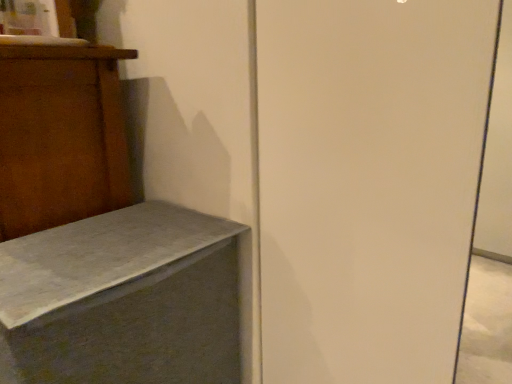
This screenshot has width=512, height=384. Find the location of `matte gray concrete bench at lower left`. matte gray concrete bench at lower left is located at coordinates (123, 300).

This screenshot has height=384, width=512. Describe the element at coordinates (123, 300) in the screenshot. I see `matte gray concrete bench at lower left` at that location.

Measure the distance between matte gray concrete bench at lower left and camera.

The distance of matte gray concrete bench at lower left from camera is 69.78 centimeters.

Measure the distance between white matte screen door at center and camera.

They are 65.05 centimeters apart.

In order to face white matte screen door at center, should I rotate leftwards or rightwards?

Rotate right and turn 14.282 degrees.

Describe the element at coordinates (368, 183) in the screenshot. This screenshot has height=384, width=512. I see `white matte screen door at center` at that location.

The image size is (512, 384). Identify the location of white matte screen door at center. (368, 183).

Identify the location of matte gray concrete bench at lower left. Image resolution: width=512 pixels, height=384 pixels. (123, 300).

Between matte gray concrete bench at lower left and white matte screen door at center, which one appears on the right side from the viewer's perspective?

white matte screen door at center is more to the right.

Between matte gray concrete bench at lower left and white matte screen door at center, which one is positioned behind?

matte gray concrete bench at lower left.

Which is farther from the camera, (59,327) or (445,3)?

Positioned behind is point (59,327).

From the image's perspective, which object appears higher, matte gray concrete bench at lower left or white matte screen door at center?

white matte screen door at center, from the image's perspective.

From a real-world perspective, between matte gray concrete bench at lower left and white matte screen door at center, who is vertically higher?

white matte screen door at center, from a real-world perspective.

Considering the sizes of objects matte gray concrete bench at lower left and white matte screen door at center in the image provided, who is wider, matte gray concrete bench at lower left or white matte screen door at center?

matte gray concrete bench at lower left is wider.

Can you confirm if matte gray concrete bench at lower left is taller than white matte screen door at center?

No.

Does matte gray concrete bench at lower left have a smaller size compared to white matte screen door at center?

Actually, matte gray concrete bench at lower left might be larger than white matte screen door at center.

Which is correct: matte gray concrete bench at lower left is inside white matte screen door at center, or outside of it?

matte gray concrete bench at lower left is located beyond the bounds of white matte screen door at center.

Are matte gray concrete bench at lower left and white matte screen door at center beside each other?

They are not placed beside each other.

Could you tell me if matte gray concrete bench at lower left is turned towards white matte screen door at center?

No, matte gray concrete bench at lower left does not turn towards white matte screen door at center.

How different are the orientations of matte gray concrete bench at lower left and white matte screen door at center in degrees?

The angle between the facing direction of matte gray concrete bench at lower left and the facing direction of white matte screen door at center is 0.229 degrees.

Where is `screen door in front of the matte gray concrete bench at lower left`? This screenshot has width=512, height=384. screen door in front of the matte gray concrete bench at lower left is located at coordinates (368, 183).

Based on their positions, is white matte screen door at center located to the left or right of matte gray concrete bench at lower left?

From the image, it's evident that white matte screen door at center is to the right of matte gray concrete bench at lower left.

Which object is more forward, white matte screen door at center or matte gray concrete bench at lower left?

white matte screen door at center is in front.

Is point (410, 290) farther from camera compared to point (72, 305)?

Yes.

From the image's perspective, is white matte screen door at center under matte gray concrete bench at lower left?

No, from the image's perspective, white matte screen door at center is not below matte gray concrete bench at lower left.

From a real-world perspective, is white matte screen door at center physically below matte gray concrete bench at lower left?

Incorrect, from a real-world perspective, white matte screen door at center is higher than matte gray concrete bench at lower left.

Is white matte screen door at center wider than matte gray concrete bench at lower left?

Incorrect, the width of white matte screen door at center does not surpass that of matte gray concrete bench at lower left.

In terms of height, does white matte screen door at center look taller or shorter compared to matte gray concrete bench at lower left?

In the image, white matte screen door at center appears to be taller than matte gray concrete bench at lower left.

Considering the sizes of objects white matte screen door at center and matte gray concrete bench at lower left in the image provided, who is bigger, white matte screen door at center or matte gray concrete bench at lower left?

matte gray concrete bench at lower left is bigger.

Is matte gray concrete bench at lower left a part of white matte screen door at center?

Actually, matte gray concrete bench at lower left is outside white matte screen door at center.

Does white matte screen door at center touch matte gray concrete bench at lower left?

white matte screen door at center and matte gray concrete bench at lower left are clearly separated.

Could you tell me if white matte screen door at center is turned towards matte gray concrete bench at lower left?

No.

How distant is white matte screen door at center from matte gray concrete bench at lower left?

A distance of 15.77 inches exists between white matte screen door at center and matte gray concrete bench at lower left.

Identify the location of furniture lying behind the white matte screen door at center. Image resolution: width=512 pixels, height=384 pixels. (123, 300).

The image size is (512, 384). I want to click on screen door in front of the matte gray concrete bench at lower left, so click(x=368, y=183).

Where is `furniture below the white matte screen door at center (from the image's perspective)`? This screenshot has width=512, height=384. furniture below the white matte screen door at center (from the image's perspective) is located at coordinates (123, 300).